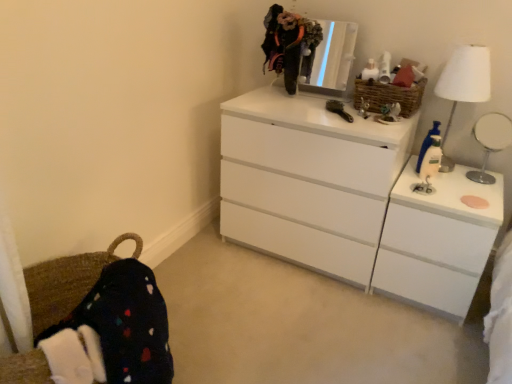
Find the location of a particular element. This screenshot has height=384, width=512. free space in front of fuzzy fabric at upper center is located at coordinates (282, 102).